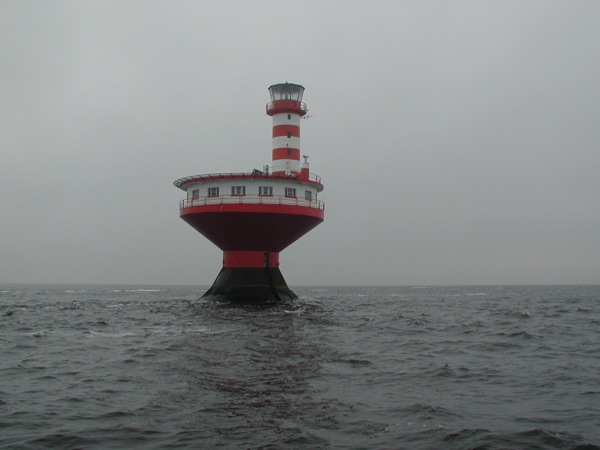
Where is `window`? window is located at coordinates (264, 190).